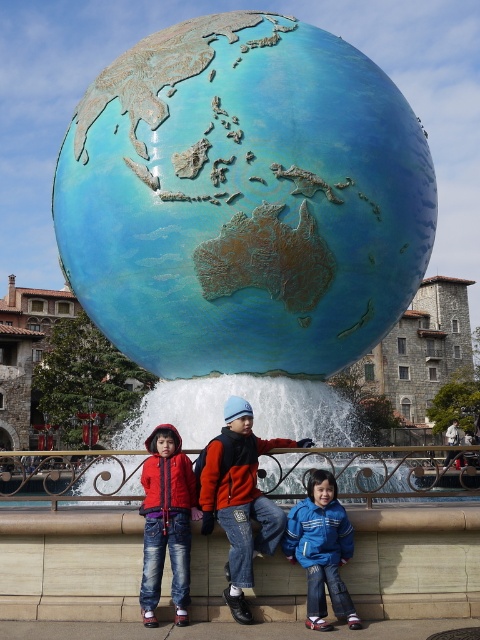
You are a photographer trying to capture a photo of the globe sculpture. You notice two jackets in the foreground, the denim jacket at lower left and the blue fleece jacket at lower right. Which jacket is closer to you, the photographer, so you can focus on it first?

The denim jacket at lower left is closer to the photographer than the blue fleece jacket at lower right, so focus on the denim jacket at lower left first.

You are a photographer standing at the edge of the plaza. You need to place a small tripod between the smooth stone ledge at lower center and the matte blue beanie at center. The tripod requires at least 6 feet of space to set up. Based on the scene, will there be enough space?

The distance between the smooth stone ledge at lower center and the matte blue beanie at center is 5.98 feet, which is slightly less than the required 6 feet. Therefore, there is not enough space to set up the tripod.